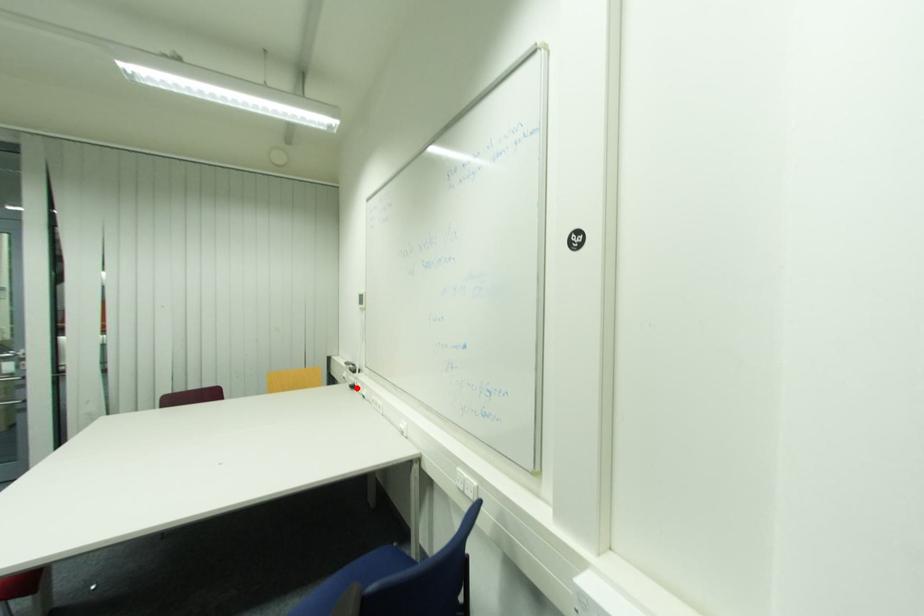
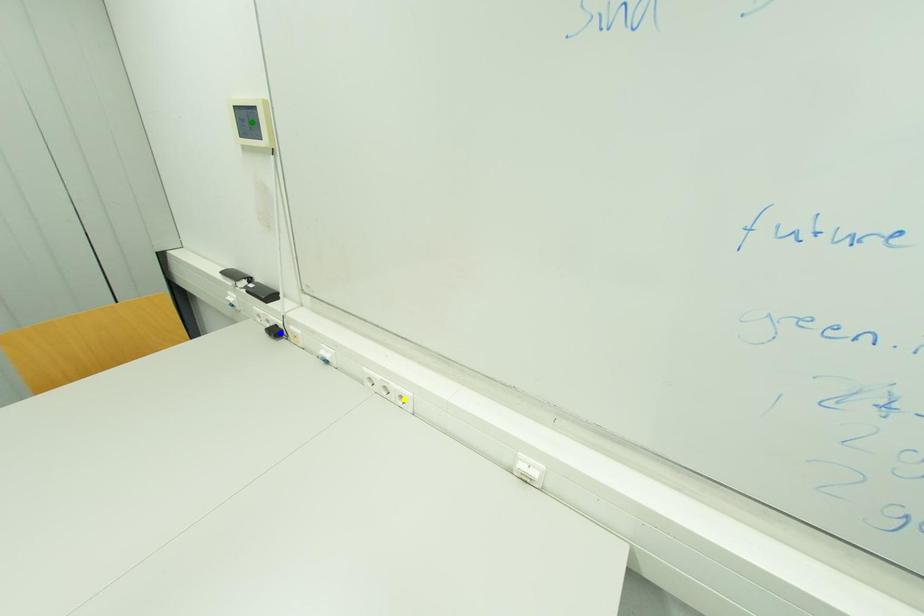
Question: I am providing you with two images of the same scene from different viewpoints. A red point is marked on the first image. You are given multiple points on the second image. Can you choose the point in image 2 that corresponds to the point in image 1?

Choices:
 (A) yellow point
 (B) green point
 (C) blue point

Answer: (C)